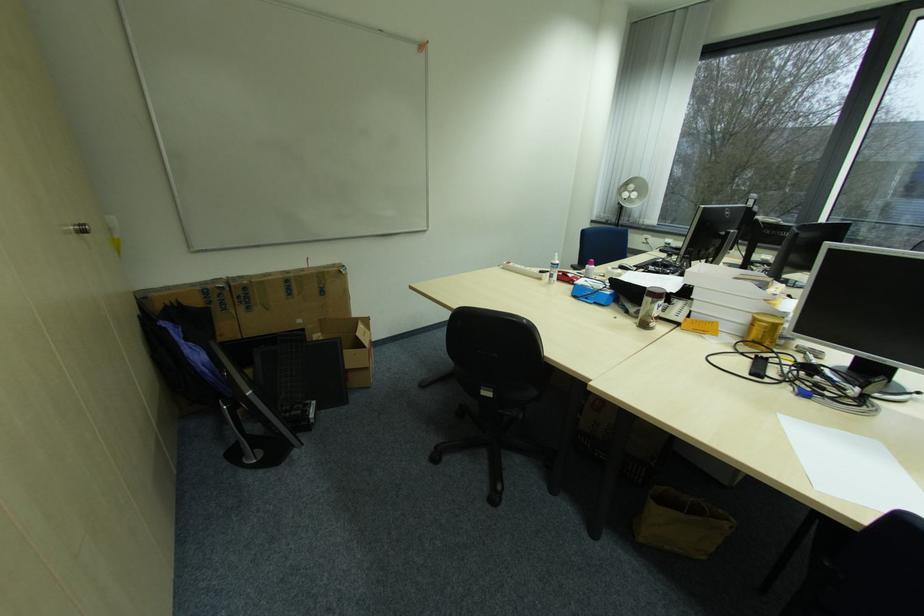
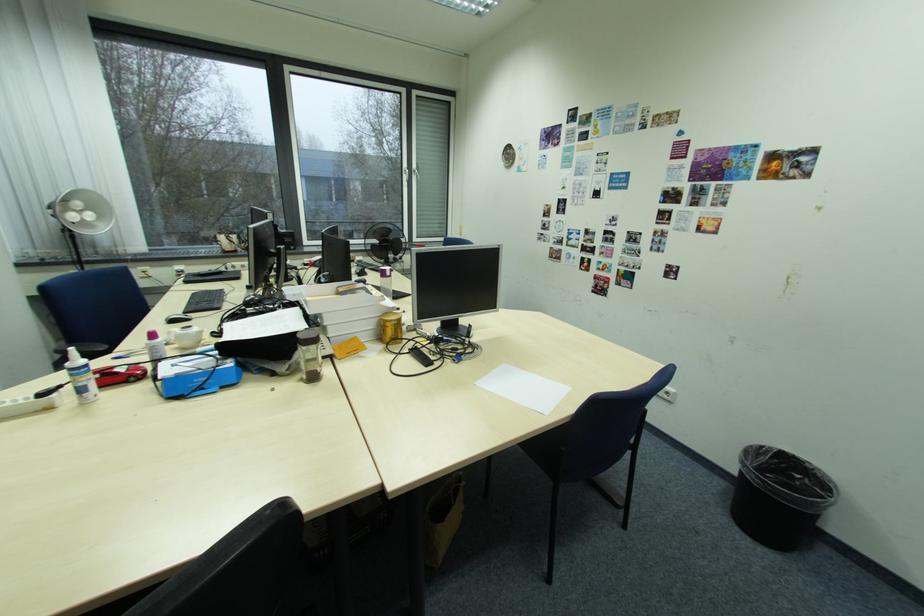
Find the pixel in the second image that matches (x=560, y=268) in the first image.

(80, 376)